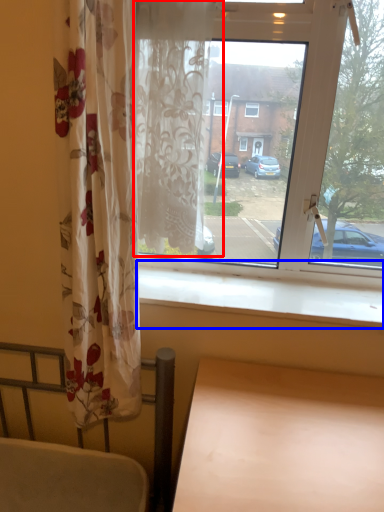
Question: Among these objects, which one is farthest to the camera, curtain (highlighted by a red box) or window sill (highlighted by a blue box)?

Choices:
 (A) curtain
 (B) window sill

Answer: (B)